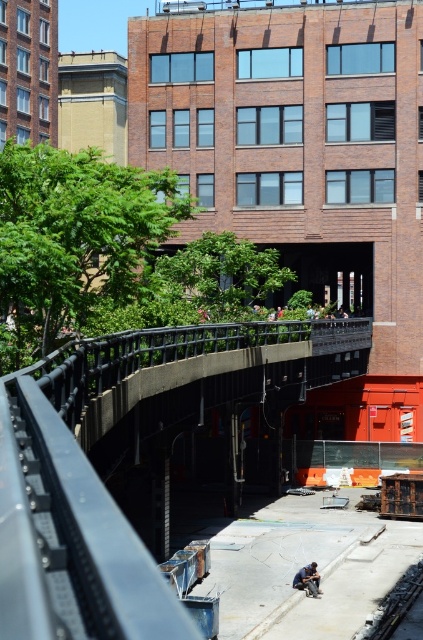
You are a delivery drone operator. Your drone is currently hovering above the concrete sidewalk at center and needs to land near the blue jeans construction worker at lower center. Considering the height difference between the two, will your drone have to descend or ascend to reach the worker?

The concrete sidewalk at center is taller than the blue jeans construction worker at lower center, so the drone will need to descend to reach the worker.

You are a delivery person trying to navigate through the urban scene. You see the concrete sidewalk at center and the blue jeans construction worker at lower center. Which object occupies more space in the image?

The concrete sidewalk at center has a larger size compared to the blue jeans construction worker at lower center, so the concrete sidewalk at center occupies more space in the image.

You are standing at the metal railing in the foreground of the urban scene. You notice two points marked in the image. The first point is at coordinate point (21, 634) and the second is at point (315, 572). Which of these two points is closer to your current position?

Point (21, 634) is in front of point (315, 572), so the first point is closer to your current position at the metal railing in the foreground.